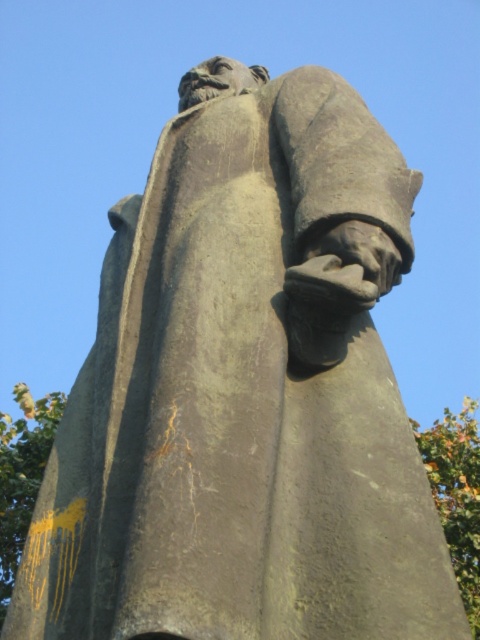
In the scene shown: Between green leafy tree at right and green leafy tree at lower left, which one appears on the right side from the viewer's perspective?

Positioned to the right is green leafy tree at right.

Which of these two, green leafy tree at right or green leafy tree at lower left, stands taller?

With more height is green leafy tree at right.

Find the location of a particular element. green leafy tree at right is located at coordinates (456, 493).

Who is positioned more to the left, green leafy tree at center or green leafy tree at right?

From the viewer's perspective, green leafy tree at center appears more on the left side.

Between green leafy tree at center and green leafy tree at right, which one has more height?

Standing taller between the two is green leafy tree at center.

Looking at this image, who is more forward, [454,428] or [477,500]?

Point [477,500] is in front.

Where is `green leafy tree at center`? green leafy tree at center is located at coordinates (456, 493).

Who is more distant from viewer, [451,513] or [1,561]?

The point [451,513] is more distant.

The image size is (480, 640). What do you see at coordinates (456, 493) in the screenshot?
I see `green leafy tree at center` at bounding box center [456, 493].

The width and height of the screenshot is (480, 640). What do you see at coordinates (456, 493) in the screenshot? I see `green leafy tree at center` at bounding box center [456, 493].

Locate an element on the screen. Image resolution: width=480 pixels, height=640 pixels. green leafy tree at center is located at coordinates (456, 493).